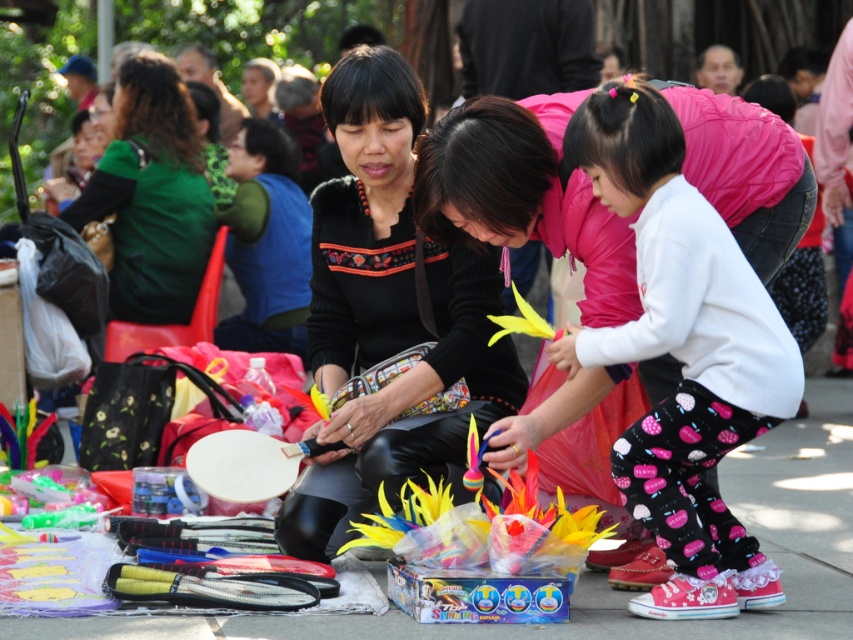
Question: Considering the relative positions of smooth concrete pavement at center and green matte shirt at upper left in the image provided, where is smooth concrete pavement at center located with respect to green matte shirt at upper left?

Choices:
 (A) below
 (B) above

Answer: (A)

Question: Which of the following is the closest to the observer?

Choices:
 (A) black leather jacket at center
 (B) white fleece sweater at center

Answer: (B)

Question: Can you confirm if smooth concrete pavement at center is bigger than green matte shirt at upper left?

Choices:
 (A) no
 (B) yes

Answer: (B)

Question: Among these points, which one is farthest from the camera?

Choices:
 (A) (791, 426)
 (B) (331, 554)
 (C) (770, 403)

Answer: (A)

Question: Does white fleece sweater at center lie in front of black leather jacket at center?

Choices:
 (A) yes
 (B) no

Answer: (A)

Question: Which of the following is the farthest from the observer?

Choices:
 (A) (689, 467)
 (B) (489, 353)

Answer: (B)